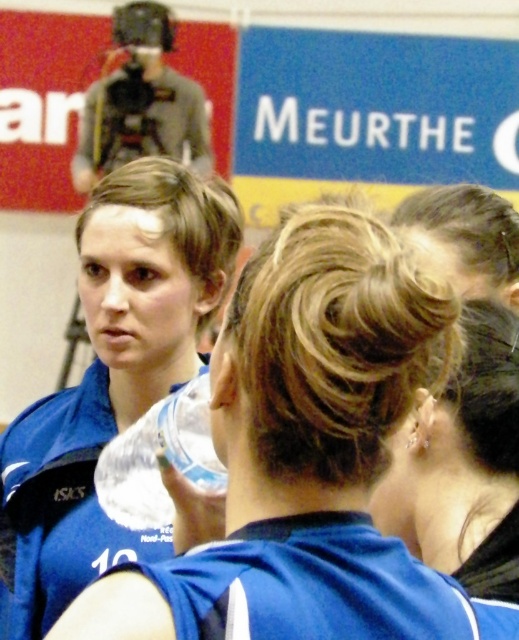
You are an event organizer arranging a photo shoot for the team. You need to position the two blue uniforms so that the blue jersey at center is to the left of the blue fabric uniform at center. Is this possible based on their current positions?

The blue jersey at center is currently to the right of the blue fabric uniform at center. To position the blue jersey at center to the left of the blue fabric uniform at center, you would need to move them so that their positions are swapped.

You are a photographer trying to capture a clear shot of both the blue jersey at center and the blue fabric uniform at center. Based on their positions, which one is more likely to be fully visible in the frame?

The blue jersey at center is wider than the blue fabric uniform at center, so the blue fabric uniform at center is more likely to be fully visible in the frame since it takes up less space.

You are organizing a sports team photo shoot and need to ensure that the blue fabric uniform at center and the clear plastic bottle at center can both fit within a 1.2 meter wide frame. Given their sizes, will they fit side by side?

The blue fabric uniform at center is wider than the clear plastic bottle at center. However, without knowing the exact widths of both items, it is impossible to determine if they will fit within the 1.2 meter frame when placed side by side.